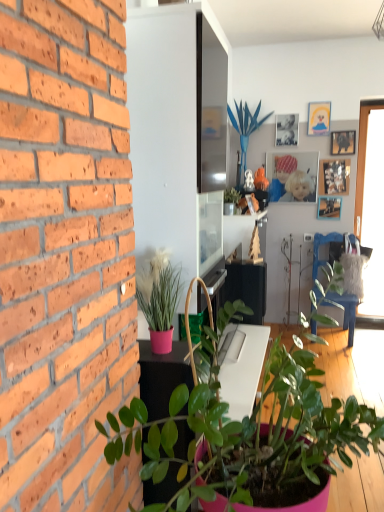
Question: In which direction should I rotate to look at matte silver photo frame at upper center, which is the 5th picture frame from bottom to top?

Choices:
 (A) left
 (B) right

Answer: (B)

Question: Is green glossy plant at upper center, placed as the 2th houseplant when sorted from back to front, inside wooden picture frame at upper right, which is the third picture frame in top-to-bottom order?

Choices:
 (A) yes
 (B) no

Answer: (B)

Question: Is wooden picture frame at upper right, the fourth picture frame in the bottom-to-top sequence, next to green glossy plant at upper center, placed as the 2th houseplant when sorted from back to front?

Choices:
 (A) no
 (B) yes

Answer: (A)

Question: Can you confirm if wooden picture frame at upper right, which is the third picture frame in top-to-bottom order, is smaller than green glossy plant at upper center, positioned as the second houseplant in top-to-bottom order?

Choices:
 (A) no
 (B) yes

Answer: (B)

Question: From the image's perspective, is wooden picture frame at upper right, which is the third picture frame in top-to-bottom order, on top of green glossy plant at upper center, which is the 3th houseplant in front-to-back order?

Choices:
 (A) no
 (B) yes

Answer: (B)

Question: Is wooden picture frame at upper right, which is the third picture frame in top-to-bottom order, at the right side of green glossy plant at upper center, which is the 3th houseplant in front-to-back order?

Choices:
 (A) yes
 (B) no

Answer: (A)

Question: Is wooden picture frame at upper right, which is the third picture frame in top-to-bottom order, oriented towards green glossy plant at upper center, placed as the 2th houseplant when sorted from back to front?

Choices:
 (A) yes
 (B) no

Answer: (B)

Question: Does matte silver photo frame at upper center, which is the 5th picture frame from bottom to top, have a lesser width compared to transparent glass window at right?

Choices:
 (A) no
 (B) yes

Answer: (B)

Question: Is the position of matte silver photo frame at upper center, which is the 5th picture frame from bottom to top, more distant than that of transparent glass window at right?

Choices:
 (A) no
 (B) yes

Answer: (B)

Question: Is matte silver photo frame at upper center, arranged as the second picture frame when viewed from the top, placed right next to transparent glass window at right?

Choices:
 (A) no
 (B) yes

Answer: (A)

Question: Is matte silver photo frame at upper center, arranged as the second picture frame when viewed from the top, oriented towards transparent glass window at right?

Choices:
 (A) yes
 (B) no

Answer: (B)

Question: Can you confirm if matte silver photo frame at upper center, arranged as the second picture frame when viewed from the top, is wider than transparent glass window at right?

Choices:
 (A) no
 (B) yes

Answer: (A)

Question: Is matte silver photo frame at upper center, arranged as the second picture frame when viewed from the top, turned away from transparent glass window at right?

Choices:
 (A) no
 (B) yes

Answer: (A)

Question: Considering the relative positions of pink matte plant at left, which is the 3th houseplant from back to front, and wooden picture frame at upper right, marked as the 6th picture frame in a top-to-bottom arrangement, in the image provided, is pink matte plant at left, which is the 3th houseplant from back to front, to the right of wooden picture frame at upper right, marked as the 6th picture frame in a top-to-bottom arrangement, from the viewer's perspective?

Choices:
 (A) no
 (B) yes

Answer: (A)